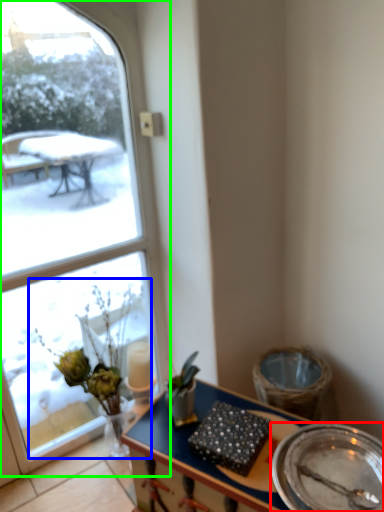
Question: Which is nearer to the plate (highlighted by a red box)? floral arrangement (highlighted by a blue box) or window (highlighted by a green box).

Choices:
 (A) floral arrangement
 (B) window

Answer: (A)